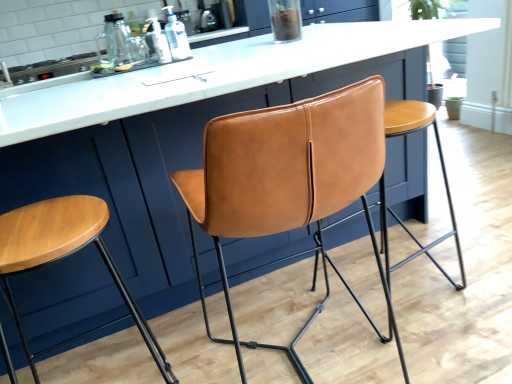
Image resolution: width=512 pixels, height=384 pixels. I want to click on free spot below cognac leather chair at center (from a real-world perspective), so click(314, 356).